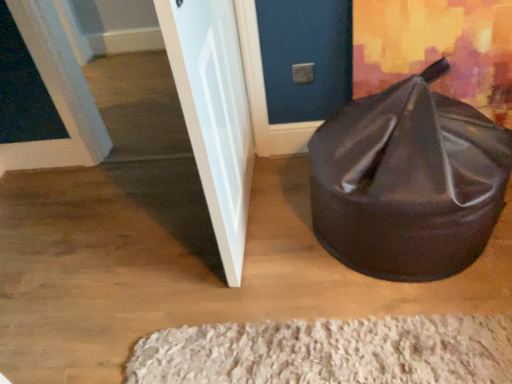
This screenshot has width=512, height=384. Identify the location of free space to the left of black leather bean bag at lower right. (244, 244).